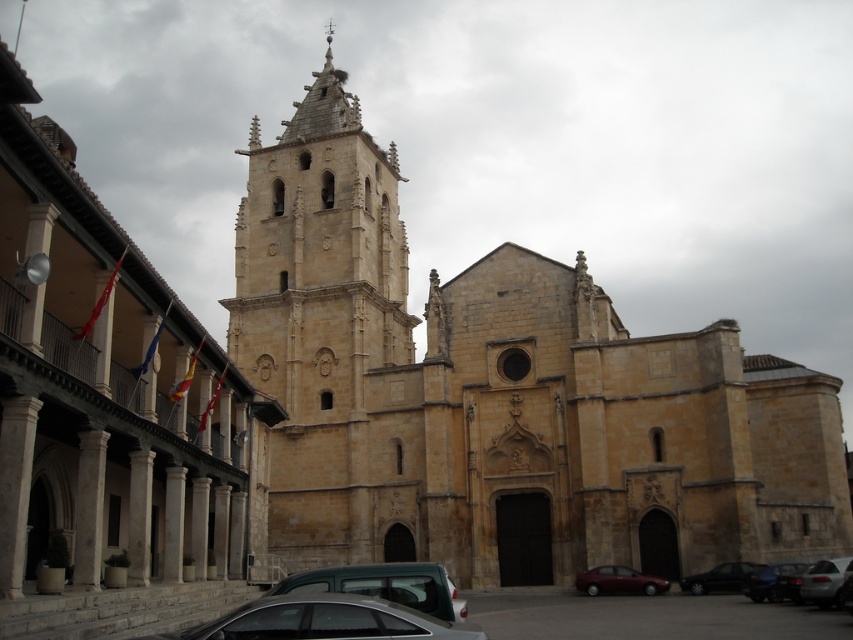
You are standing at the entrance of the beige stone church at center and want to see the silver metallic car at lower right. In which direction should you look relative to your position?

You should look downward because the beige stone church at center is above the silver metallic car at lower right.

You are standing in front of the historic stone church and want to take a photo of the yellow stone tower at center and the silver metallic car at lower center. Which object will appear larger in the photo?

The yellow stone tower at center will appear larger in the photo because it is positioned over the silver metallic car at lower center, indicating it is closer to the camera, and objects closer to the camera appear larger.

You are a photographer planning to take a picture of the beige stone church at center and the silver metallic car at lower right. You want to ensure both are visible in the frame. Based on their positions, which object should you place closer to the left side of your camera frame?

The beige stone church at center is positioned on the left side of the silver metallic car at lower right, so to include both in the frame, you should place the beige stone church at center closer to the left side of your camera frame.